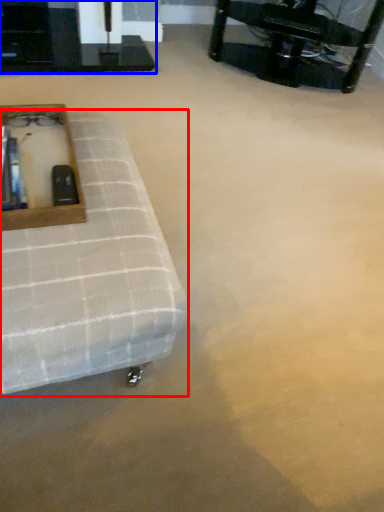
Question: Which object appears closest to the camera in this image, furniture (highlighted by a red box) or table (highlighted by a blue box)?

Choices:
 (A) furniture
 (B) table

Answer: (A)